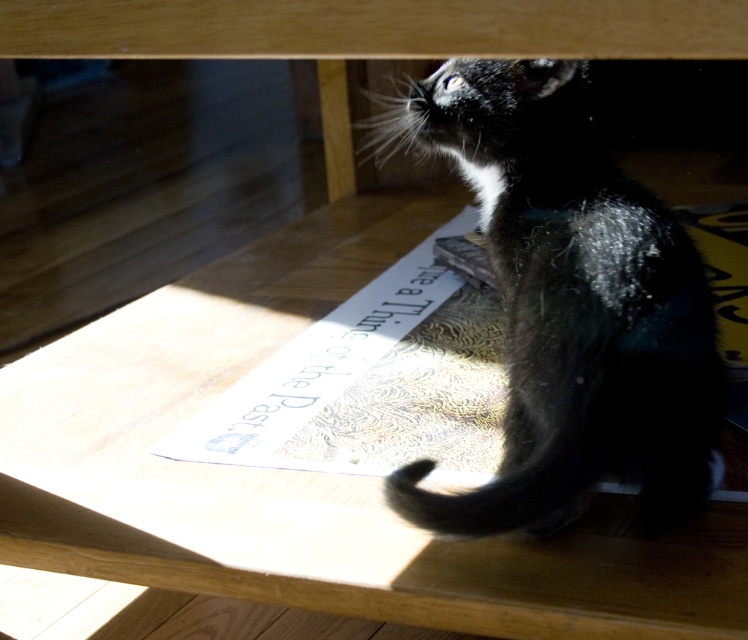
You are standing in front of the wooden furniture where the cat is hiding. There are two points marked on the furniture surface. The first point is at coordinates point (183, 412) and the second point is at point (634, 253). Which point is closer to you?

Point (183, 412) is further to the camera than point (634, 253). Therefore, point (634, 253) is closer to you.